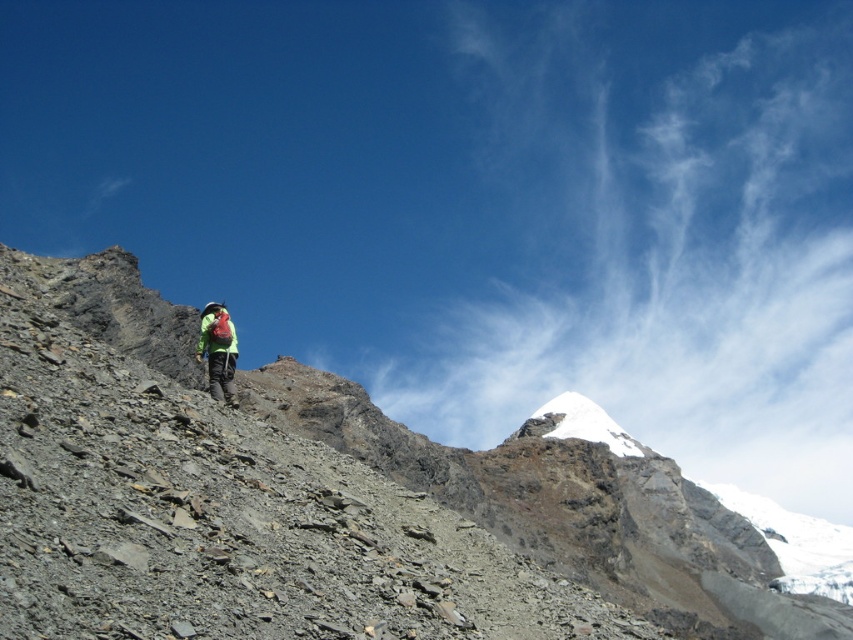
Question: Can you confirm if white snow-covered peak at center is positioned to the right of green fabric backpack at center?

Choices:
 (A) yes
 (B) no

Answer: (A)

Question: Estimate the real-world distances between objects in this image. Which object is farther from the green fabric backpack at center?

Choices:
 (A) rugged stone mountain at center
 (B) white snow-covered peak at center

Answer: (B)

Question: Which point is closer to the camera?

Choices:
 (A) (125, 333)
 (B) (221, 355)
 (C) (573, 436)

Answer: (B)

Question: Does rugged stone mountain at center have a larger size compared to white snow-covered peak at center?

Choices:
 (A) no
 (B) yes

Answer: (B)

Question: Which point appears farthest from the camera in this image?

Choices:
 (A) (212, 326)
 (B) (262, 582)

Answer: (A)

Question: Is white snow-covered peak at center closer to the viewer compared to green fabric backpack at center?

Choices:
 (A) no
 (B) yes

Answer: (A)